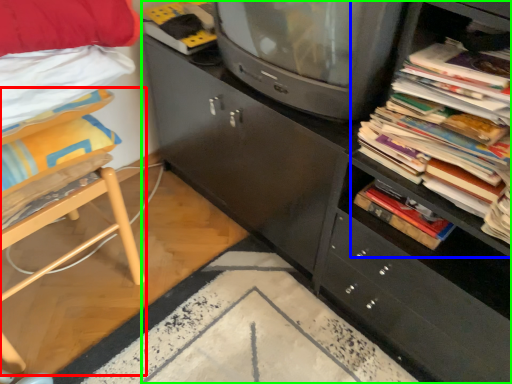
Question: Estimate the real-world distances between objects in this image. Which object is farther from furniture (highlighted by a red box), shelf (highlighted by a blue box) or cabinetry (highlighted by a green box)?

Choices:
 (A) shelf
 (B) cabinetry

Answer: (A)